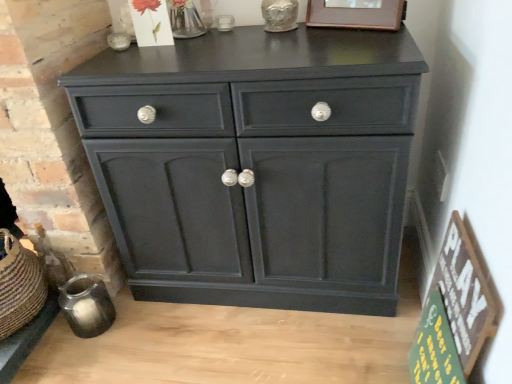
Question: Is wooden picture frame at upper center not inside wooden sign at lower right, the 2th bulletin board in the bottom-to-top sequence?

Choices:
 (A) no
 (B) yes

Answer: (B)

Question: Is wooden picture frame at upper center bigger than wooden sign at lower right, the 2th bulletin board in the bottom-to-top sequence?

Choices:
 (A) no
 (B) yes

Answer: (A)

Question: Can you confirm if wooden picture frame at upper center is taller than wooden sign at lower right, the 1th bulletin board viewed from the top?

Choices:
 (A) no
 (B) yes

Answer: (A)

Question: From the image's perspective, does wooden picture frame at upper center appear lower than wooden sign at lower right, the 2th bulletin board in the bottom-to-top sequence?

Choices:
 (A) yes
 (B) no

Answer: (B)

Question: Is wooden picture frame at upper center next to wooden sign at lower right, the 1th bulletin board viewed from the top?

Choices:
 (A) no
 (B) yes

Answer: (A)

Question: Does wooden picture frame at upper center have a smaller size compared to wooden sign at lower right, the 2th bulletin board in the bottom-to-top sequence?

Choices:
 (A) no
 (B) yes

Answer: (B)

Question: Is the surface of wooden picture frame at upper center in direct contact with green wood sign at lower right, the 2th bulletin board viewed from the top?

Choices:
 (A) yes
 (B) no

Answer: (B)

Question: From the image's perspective, would you say wooden picture frame at upper center is positioned over green wood sign at lower right, positioned as the first bulletin board in bottom-to-top order?

Choices:
 (A) yes
 (B) no

Answer: (A)

Question: Would you consider wooden picture frame at upper center to be distant from green wood sign at lower right, positioned as the first bulletin board in bottom-to-top order?

Choices:
 (A) yes
 (B) no

Answer: (B)

Question: Does wooden picture frame at upper center appear on the left side of green wood sign at lower right, positioned as the first bulletin board in bottom-to-top order?

Choices:
 (A) no
 (B) yes

Answer: (B)

Question: From a real-world perspective, is wooden picture frame at upper center physically above green wood sign at lower right, positioned as the first bulletin board in bottom-to-top order?

Choices:
 (A) no
 (B) yes

Answer: (B)

Question: Would you say wooden picture frame at upper center contains green wood sign at lower right, positioned as the first bulletin board in bottom-to-top order?

Choices:
 (A) no
 (B) yes

Answer: (A)

Question: Considering the relative positions of wooden sign at lower right, the 1th bulletin board viewed from the top, and wooden picture frame at upper center in the image provided, is wooden sign at lower right, the 1th bulletin board viewed from the top, to the right of wooden picture frame at upper center from the viewer's perspective?

Choices:
 (A) no
 (B) yes

Answer: (B)